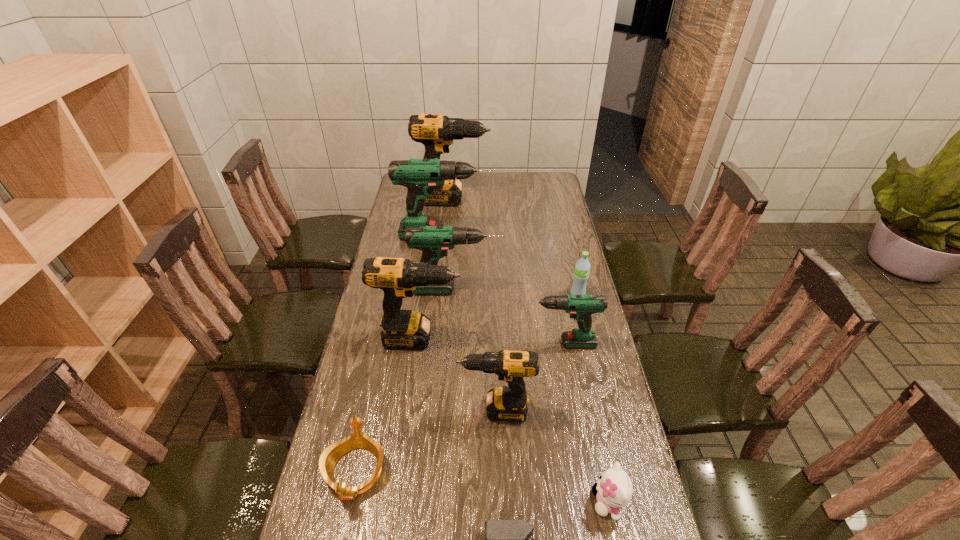
Point out which green drill is positioned as the nearest to the gold tiara. Please provide its 2D coordinates. Your answer should be formatted as a tuple, i.e. [(x, y)], where the tuple contains the x and y coordinates of a point satisfying the conditions above.

[(581, 307)]

Image resolution: width=960 pixels, height=540 pixels. Find the location of `vacant space that satisfies the following two spatial constraints: 1. on the handle side of the fourth nearest drill; 2. at the front emblem of the ninth tallest object`. vacant space that satisfies the following two spatial constraints: 1. on the handle side of the fourth nearest drill; 2. at the front emblem of the ninth tallest object is located at coordinates (446, 471).

This screenshot has height=540, width=960. Find the location of `free location that satisfies the following two spatial constraints: 1. on the handle side of the green water bottle; 2. on the left side of the biggest green drill`. free location that satisfies the following two spatial constraints: 1. on the handle side of the green water bottle; 2. on the left side of the biggest green drill is located at coordinates (441, 294).

Where is `free location that satisfies the following two spatial constraints: 1. at the tip of the second smallest black drill; 2. at the front emblem of the second shortest object`? This screenshot has width=960, height=540. free location that satisfies the following two spatial constraints: 1. at the tip of the second smallest black drill; 2. at the front emblem of the second shortest object is located at coordinates (402, 471).

What are the coordinates of `vacant space that satisfies the following two spatial constraints: 1. on the handle side of the farthest green drill; 2. at the front emblem of the tiara` in the screenshot? It's located at [x=422, y=471].